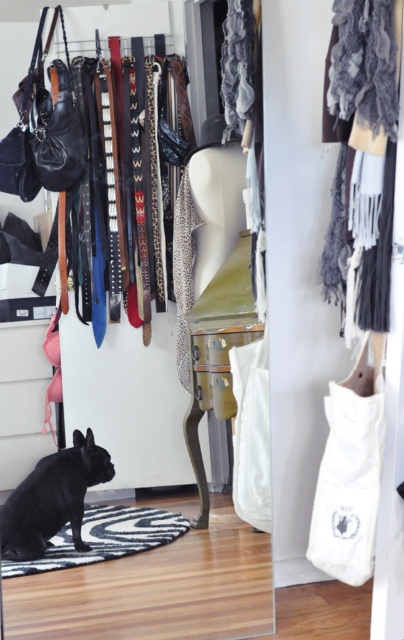
Based on the photo, you are standing in the closet and see the point marked at coordinates (x=52, y=499). What object is located at that point?

The point at coordinates (x=52, y=499) indicates the location of the black matte dog at lower left.

You are organizing a closet and need to place the white canvas bag at lower right and the white fabric bag at center on a shelf. The shelf has limited vertical space. Which bag should you place first to ensure both fit vertically?

The white canvas bag at lower right is shorter than the white fabric bag at center, so place the taller white fabric bag at center first to accommodate its height, then the shorter white canvas bag at lower right will fit underneath without exceeding the shelf height.